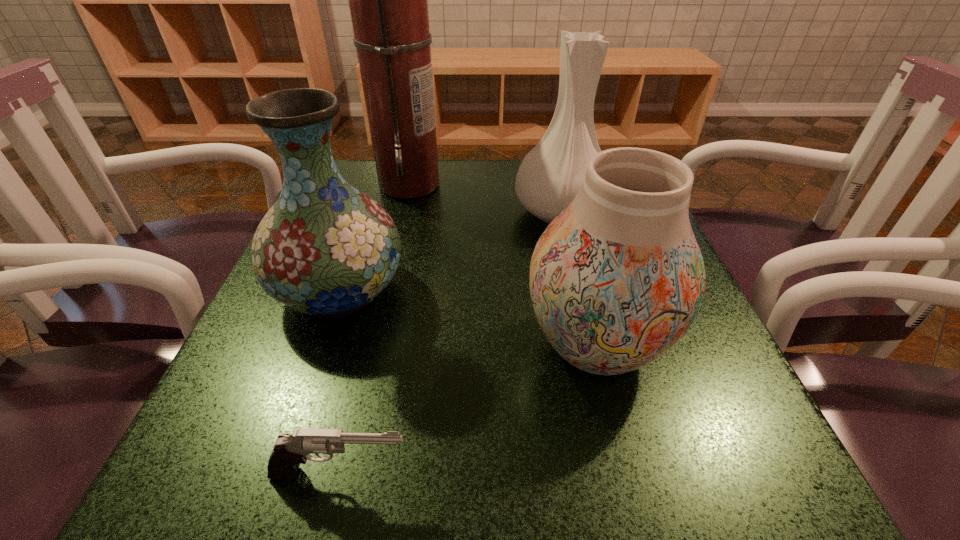
What are the coordinates of `vase object that ranks as the second closest to the nearest object` in the screenshot? It's located at (326, 249).

This screenshot has height=540, width=960. I want to click on the closest vase to the fire extinguisher, so click(x=326, y=249).

Locate an element on the screen. blank area in the image that satisfies the following two spatial constraints: 1. on the front-facing side of the farthest vase; 2. on the right side of the tallest object is located at coordinates (403, 212).

Find the location of a particular element. free location that satisfies the following two spatial constraints: 1. on the back side of the farthest vase; 2. on the front-facing side of the fire extinguisher is located at coordinates (554, 184).

I want to click on free location that satisfies the following two spatial constraints: 1. on the front-facing side of the farthest vase; 2. on the right side of the fire extinguisher, so click(x=403, y=212).